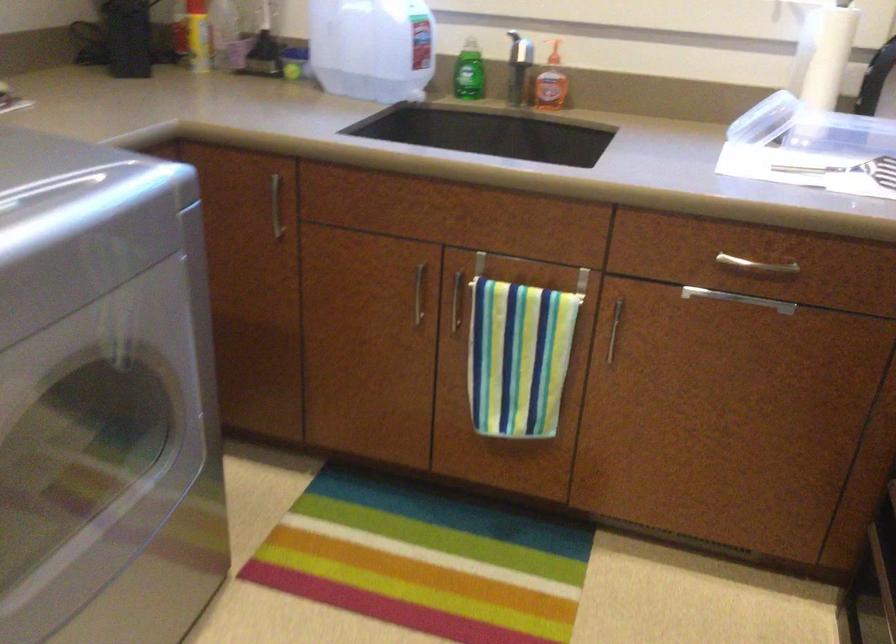
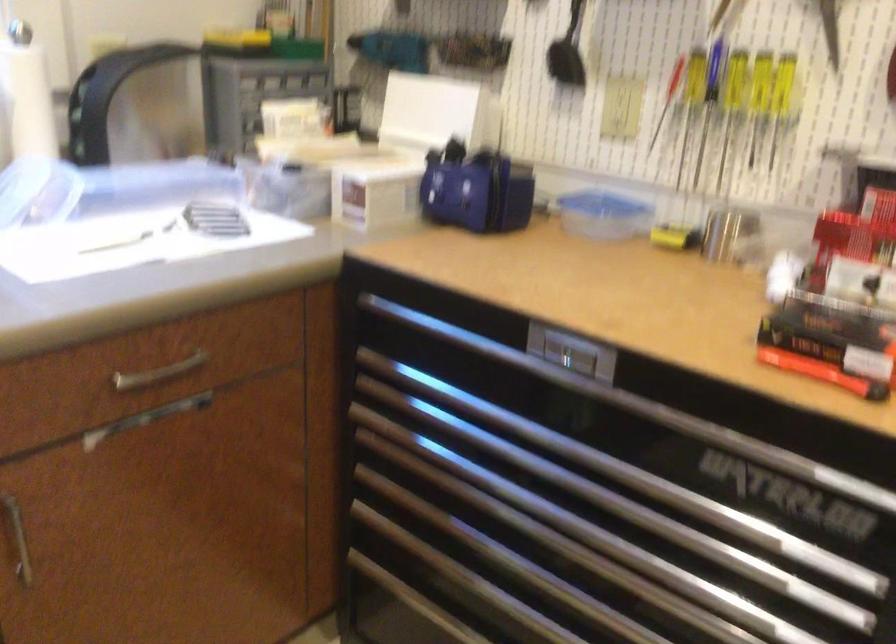
Question: How did the camera likely rotate?

Choices:
 (A) Left
 (B) Right
 (C) Up
 (D) Down

Answer: (B)